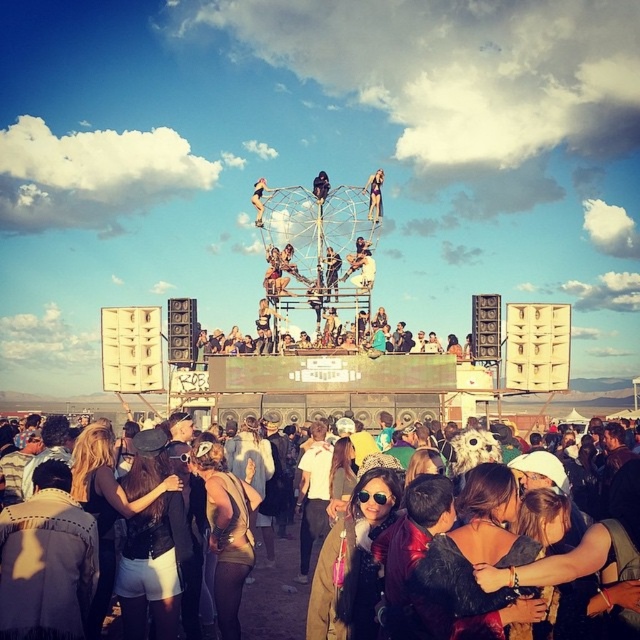
Question: Which object is closer to the camera taking this photo?

Choices:
 (A) matte black bikini at center
 (B) metallic silver pole at center
 (C) metallic silver figure at center
 (D) metallic silver microphone at center

Answer: (D)

Question: Which object appears farthest from the camera in this image?

Choices:
 (A) matte black jacket at lower center
 (B) matte black bikini at center
 (C) metallic silver pole at center
 (D) metallic silver figure at center

Answer: (D)

Question: Can you confirm if metallic silver microphone at center is bigger than matte black bikini at center?

Choices:
 (A) yes
 (B) no

Answer: (A)

Question: Can you confirm if matte black jacket at lower center is positioned to the right of metallic silver figure at center?

Choices:
 (A) no
 (B) yes

Answer: (A)

Question: Can you confirm if matte black jacket at lower center is positioned below matte black bikini at center?

Choices:
 (A) yes
 (B) no

Answer: (A)

Question: Which point is closer to the camera?

Choices:
 (A) (260, 193)
 (B) (250, 352)
 (C) (376, 211)
 (D) (301, 627)

Answer: (D)